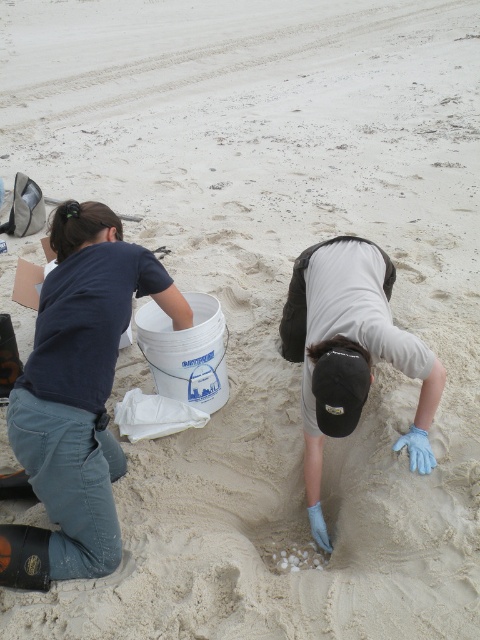
You are a lifeguard observing the beach scene. You notice the dark blue fabric squat at left and the blue latex gloves at lower center. Which object is taller in this scene?

The dark blue fabric squat at left is taller than the blue latex gloves at lower center.

In the scene shown: You are a lifeguard observing the beach scene. You notice the dark blue fabric squat at left and the blue latex gloves at lower center. Which object is more likely to be wider in this context?

The dark blue fabric squat at left is wider than the blue latex gloves at lower center according to the description.